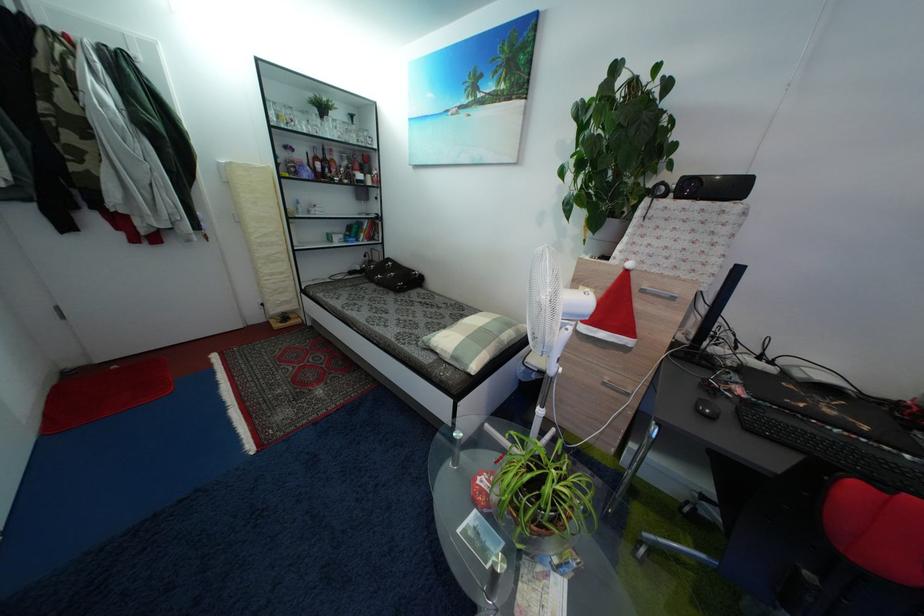
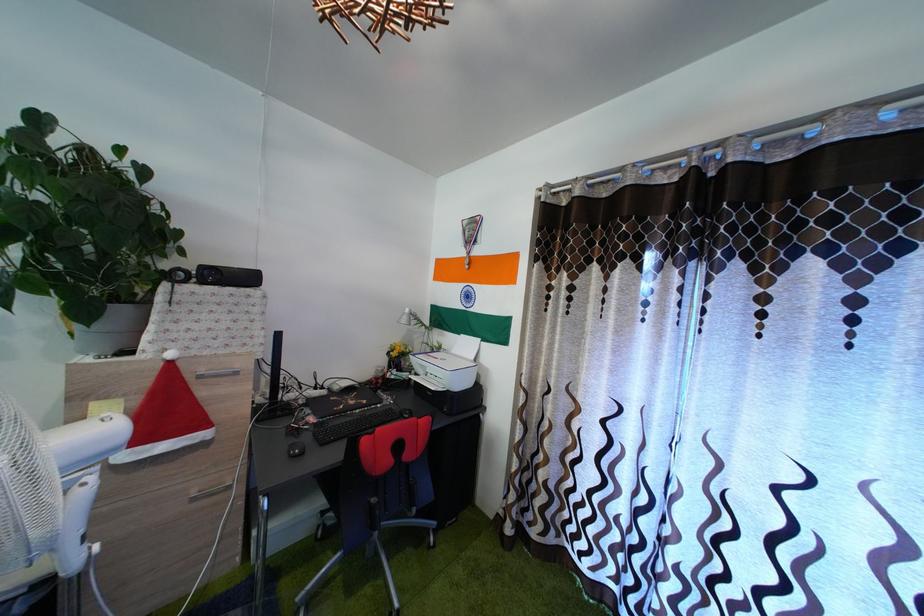
In the second image, find the point that corresponds to the point at 619,230 in the first image.

(128, 318)